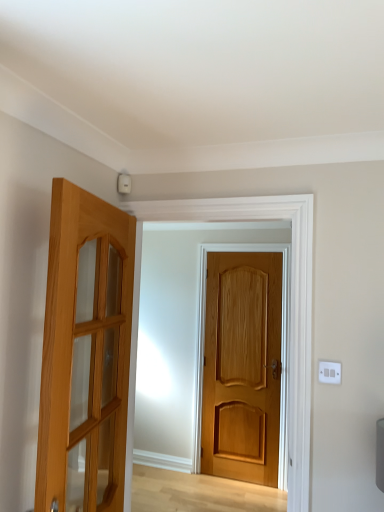
Find the location of a particular element. This screenshot has height=512, width=384. vacant area on top of light brown wooden door at center, acting as the 2th door starting from the left (from a real-world perspective) is located at coordinates (259, 247).